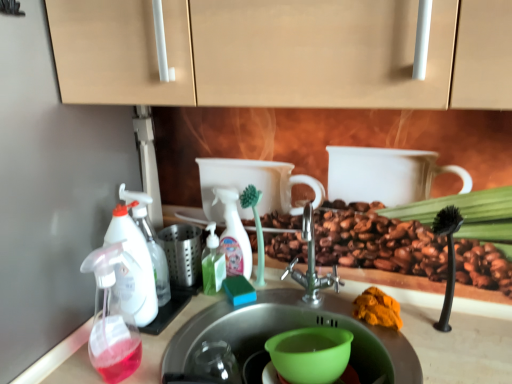
The height and width of the screenshot is (384, 512). What are the coordinates of `free space between translucent plastic spray bottle at left, the 3th soap dispenser viewed from the back, and green translucent soap dispenser at center, which is the first soap dispenser from back to front` in the screenshot? It's located at (179, 322).